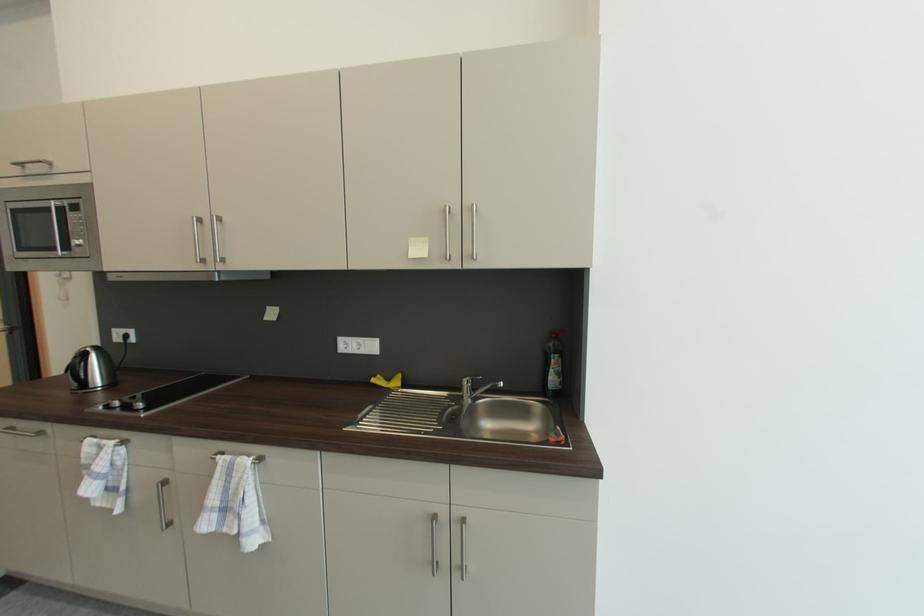
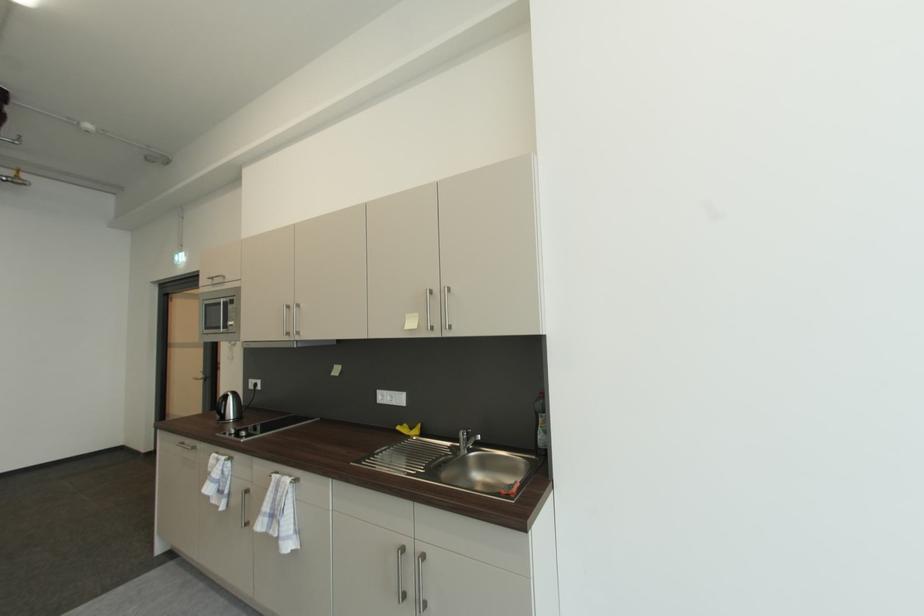
Find the pixel in the second image that matches the point at 382,378 in the first image.

(408, 427)